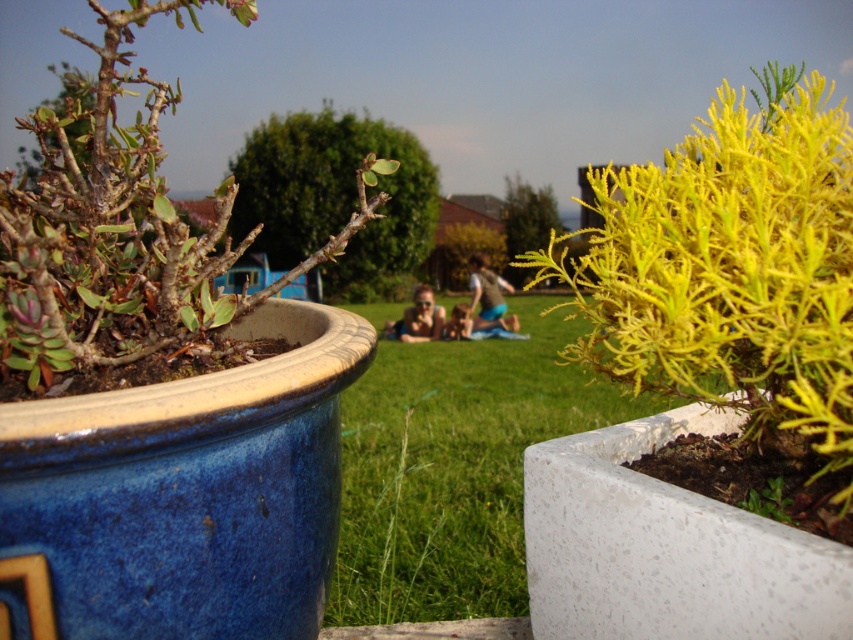
Question: Does green fabric shorts at center have a larger size compared to matte skin person at center?

Choices:
 (A) yes
 (B) no

Answer: (B)

Question: Which object appears closest to the camera in this image?

Choices:
 (A) matte skin person at center
 (B) green fabric shorts at center

Answer: (A)

Question: Considering the real-world distances, which object is farthest from the green fabric shorts at center?

Choices:
 (A) green grass at center
 (B) matte skin person at center
 (C) yellow-green leafy plant at right
 (D) brown textured plant at left

Answer: (C)

Question: Among these points, which one is nearest to the camera?

Choices:
 (A) (486, 268)
 (B) (409, 316)
 (C) (618, 204)

Answer: (C)

Question: Is yellow-green leafy plant at right to the right of green grass at center from the viewer's perspective?

Choices:
 (A) yes
 (B) no

Answer: (B)

Question: Considering the relative positions of green grass at center and matte skin person at center in the image provided, where is green grass at center located with respect to matte skin person at center?

Choices:
 (A) above
 (B) below

Answer: (B)